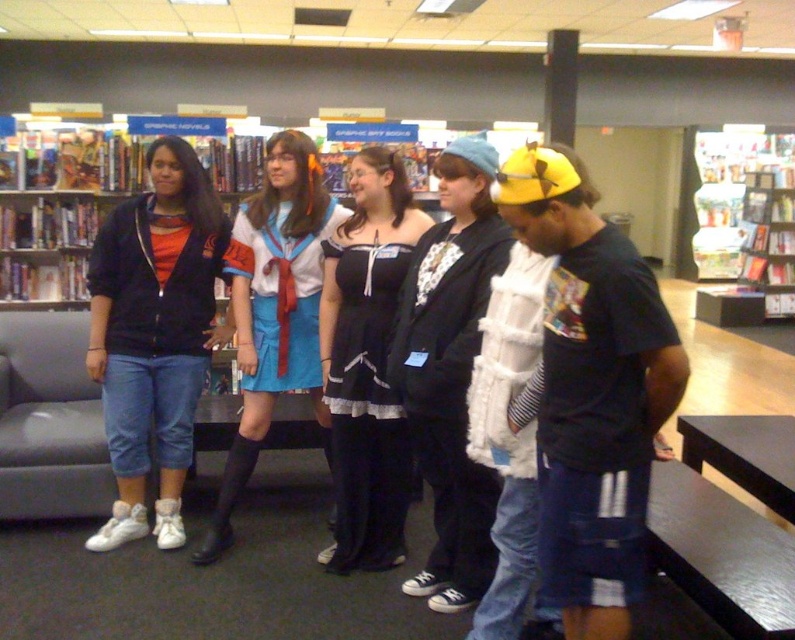
Question: Can you confirm if black lace dress at center is thinner than blue satin skirt at center?

Choices:
 (A) yes
 (B) no

Answer: (A)

Question: Is matte black jacket at left behind blue satin skirt at center?

Choices:
 (A) yes
 (B) no

Answer: (A)

Question: Which point is closer to the camera taking this photo?

Choices:
 (A) (258, 388)
 (B) (590, 184)

Answer: (B)

Question: Which point is farther to the camera?

Choices:
 (A) (704, 291)
 (B) (161, 348)
 (C) (253, 268)
 (D) (355, 387)

Answer: (A)

Question: Does matte black jacket at left have a greater width compared to black lace dress at center?

Choices:
 (A) no
 (B) yes

Answer: (B)

Question: Which object appears closest to the camera in this image?

Choices:
 (A) wooden bookshelf at upper right
 (B) black lace dress at center

Answer: (B)